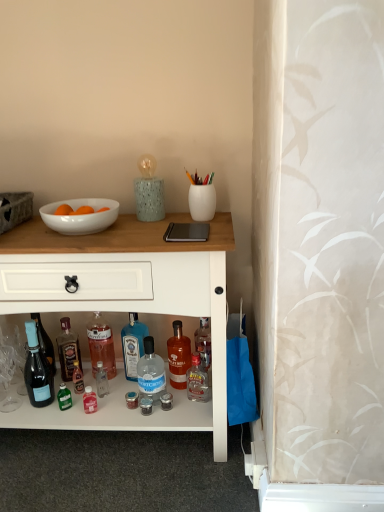
Identify the location of vacant space to the left of white glossy bowl at upper left. The height and width of the screenshot is (512, 384). (21, 233).